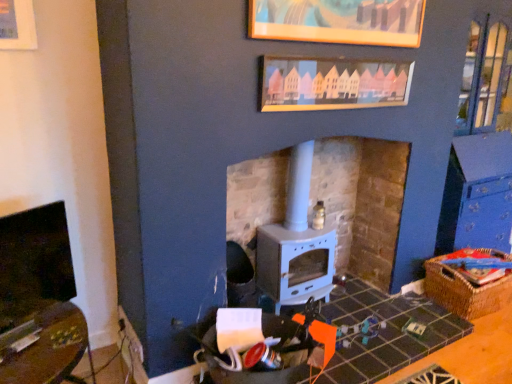
Where is `white matte wood burning stove at center`? white matte wood burning stove at center is located at coordinates (295, 244).

Where is `wooden picture frame at upper center, arranged as the 2th picture frame when viewed from the top`? wooden picture frame at upper center, arranged as the 2th picture frame when viewed from the top is located at coordinates (332, 84).

What is the approximate height of matte black fireplace at left?

matte black fireplace at left is 47.35 centimeters tall.

Where is `woven brown basket at lower right`? The width and height of the screenshot is (512, 384). woven brown basket at lower right is located at coordinates (467, 287).

In terms of size, does wooden picture frame at upper center, the first picture frame positioned from the bottom, appear bigger or smaller than woven brown basket at lower right?

Clearly, wooden picture frame at upper center, the first picture frame positioned from the bottom, is smaller in size than woven brown basket at lower right.

Between point (379, 67) and point (442, 264), which one is positioned behind?

The point (442, 264) is more distant.

What's the angular difference between wooden picture frame at upper center, arranged as the 2th picture frame when viewed from the top, and woven brown basket at lower right's facing directions?

There is a 0.9-degree angle between the facing directions of wooden picture frame at upper center, arranged as the 2th picture frame when viewed from the top, and woven brown basket at lower right.

Does wooden picture frame at upper center, arranged as the 2th picture frame when viewed from the top, appear on the left side of woven brown basket at lower right?

Indeed, wooden picture frame at upper center, arranged as the 2th picture frame when viewed from the top, is positioned on the left side of woven brown basket at lower right.

Who is smaller, white matte wood burning stove at center or matte black fireplace at left?

Smaller between the two is matte black fireplace at left.

Locate an element on the screen. The height and width of the screenshot is (384, 512). wood burning stove located above the matte black fireplace at left (from the image's perspective) is located at coordinates (295, 244).

Considering the points (288, 203) and (17, 251), which point is in front, point (288, 203) or point (17, 251)?

The point (17, 251) is closer.

Can you confirm if white matte wood burning stove at center is thinner than matte black fireplace at left?

In fact, white matte wood burning stove at center might be wider than matte black fireplace at left.

Is woven brown basket at lower right taller than wooden picture frame at upper center, arranged as the 2th picture frame when viewed from the top?

Indeed, woven brown basket at lower right has a greater height compared to wooden picture frame at upper center, arranged as the 2th picture frame when viewed from the top.

Does point (474, 299) lie in front of point (285, 96)?

No, (474, 299) is behind (285, 96).

Considering the sizes of objects woven brown basket at lower right and wooden picture frame at upper center, the first picture frame positioned from the bottom, in the image provided, who is thinner, woven brown basket at lower right or wooden picture frame at upper center, the first picture frame positioned from the bottom,?

With smaller width is wooden picture frame at upper center, the first picture frame positioned from the bottom.

Which object is further away from the camera, woven brown basket at lower right or wooden picture frame at upper center, the first picture frame positioned from the bottom?

woven brown basket at lower right is more distant.

Is woven brown basket at lower right surrounding wooden picture frame at upper center, which is the 1th picture frame in top-to-bottom order?

That's incorrect, wooden picture frame at upper center, which is the 1th picture frame in top-to-bottom order, is not inside woven brown basket at lower right.

From the image's perspective, is woven brown basket at lower right below wooden picture frame at upper center, the 2th picture frame from the bottom?

Yes, from the image's perspective, woven brown basket at lower right is beneath wooden picture frame at upper center, the 2th picture frame from the bottom.

In the image, is woven brown basket at lower right positioned in front of or behind wooden picture frame at upper center, the 2th picture frame from the bottom?

Clearly, woven brown basket at lower right is behind wooden picture frame at upper center, the 2th picture frame from the bottom.

In the scene shown: Is the surface of woven brown basket at lower right in direct contact with wooden picture frame at upper center, which is the 1th picture frame in top-to-bottom order?

No, woven brown basket at lower right is not touching wooden picture frame at upper center, which is the 1th picture frame in top-to-bottom order.

From a real-world perspective, who is located higher, wooden picture frame at upper center, arranged as the 2th picture frame when viewed from the top, or matte black fireplace at left?

wooden picture frame at upper center, arranged as the 2th picture frame when viewed from the top, from a real-world perspective.

Is wooden picture frame at upper center, the first picture frame positioned from the bottom, situated inside matte black fireplace at left or outside?

wooden picture frame at upper center, the first picture frame positioned from the bottom, exists outside the volume of matte black fireplace at left.

Considering the points (353, 96) and (3, 304), which point is in front, point (353, 96) or point (3, 304)?

Point (3, 304)

Is wooden picture frame at upper center, the first picture frame positioned from the bottom, turned away from matte black fireplace at left?

That's not correct — wooden picture frame at upper center, the first picture frame positioned from the bottom, is not looking away from matte black fireplace at left.

From a real-world perspective, is wooden picture frame at upper center, the first picture frame positioned from the bottom, below wooden picture frame at upper center, which is the 1th picture frame in top-to-bottom order?

Yes, from a real-world perspective, wooden picture frame at upper center, the first picture frame positioned from the bottom, is beneath wooden picture frame at upper center, which is the 1th picture frame in top-to-bottom order.

Is wooden picture frame at upper center, the first picture frame positioned from the bottom, next to wooden picture frame at upper center, which is the 1th picture frame in top-to-bottom order, and touching it?

They are not placed beside each other.

Is wooden picture frame at upper center, the first picture frame positioned from the bottom, turned away from wooden picture frame at upper center, which is the 1th picture frame in top-to-bottom order?

wooden picture frame at upper center, the first picture frame positioned from the bottom, is not turned away from wooden picture frame at upper center, which is the 1th picture frame in top-to-bottom order.

How much distance is there between wooden picture frame at upper center, arranged as the 2th picture frame when viewed from the top, and wooden picture frame at upper center, which is the 1th picture frame in top-to-bottom order?

wooden picture frame at upper center, arranged as the 2th picture frame when viewed from the top, is 7.37 inches from wooden picture frame at upper center, which is the 1th picture frame in top-to-bottom order.

Could you measure the distance between matte black fireplace at left and wooden picture frame at upper center, arranged as the 2th picture frame when viewed from the top?

A distance of 1.21 meters exists between matte black fireplace at left and wooden picture frame at upper center, arranged as the 2th picture frame when viewed from the top.

From a real-world perspective, which is physically above, matte black fireplace at left or wooden picture frame at upper center, the first picture frame positioned from the bottom?

Answer: In real-world perspective, wooden picture frame at upper center, the first picture frame positioned from the bottom, is above.

Which point is more distant from viewer, (x=53, y=266) or (x=331, y=84)?

The point (x=331, y=84) is farther.

Is matte black fireplace at left far away from wooden picture frame at upper center, arranged as the 2th picture frame when viewed from the top?

Yes.

At what (x,y) coordinates should I click in order to perform the action: click on crate below the wooden picture frame at upper center, the first picture frame positioned from the bottom (from the image's perspective). Please return your answer as a coordinate pair (x, y). Looking at the image, I should click on (467, 287).

The height and width of the screenshot is (384, 512). I want to click on wood burning stove below the matte black fireplace at left (from a real-world perspective), so click(x=295, y=244).

Considering their positions, is white matte wood burning stove at center positioned further to wooden picture frame at upper center, arranged as the 2th picture frame when viewed from the top, than wooden picture frame at upper center, which is the 1th picture frame in top-to-bottom order?

The object further to wooden picture frame at upper center, arranged as the 2th picture frame when viewed from the top, is white matte wood burning stove at center.

Which object lies further to the anchor point white matte wood burning stove at center, woven brown basket at lower right or matte black fireplace at left?

matte black fireplace at left is further to white matte wood burning stove at center.

Estimate the real-world distances between objects in this image. Which object is further from wooden picture frame at upper center, which is the 1th picture frame in top-to-bottom order, matte black fireplace at left or woven brown basket at lower right?

woven brown basket at lower right.

Which object lies nearer to the anchor point matte black fireplace at left, woven brown basket at lower right or wooden picture frame at upper center, the first picture frame positioned from the bottom?

wooden picture frame at upper center, the first picture frame positioned from the bottom, is closer to matte black fireplace at left.

From the image, which object appears to be nearer to wooden picture frame at upper center, which is the 1th picture frame in top-to-bottom order, white matte wood burning stove at center or wooden picture frame at upper center, arranged as the 2th picture frame when viewed from the top?

wooden picture frame at upper center, arranged as the 2th picture frame when viewed from the top, is positioned closer to the anchor wooden picture frame at upper center, which is the 1th picture frame in top-to-bottom order.

In the scene shown: When comparing their distances from wooden picture frame at upper center, the first picture frame positioned from the bottom, does wooden picture frame at upper center, which is the 1th picture frame in top-to-bottom order, or white matte wood burning stove at center seem closer?

wooden picture frame at upper center, which is the 1th picture frame in top-to-bottom order, lies closer to wooden picture frame at upper center, the first picture frame positioned from the bottom, than the other object.

Based on their spatial positions, is wooden picture frame at upper center, the first picture frame positioned from the bottom, or white matte wood burning stove at center closer to woven brown basket at lower right?

The object closer to woven brown basket at lower right is white matte wood burning stove at center.

In the scene shown: From the image, which object appears to be farther from woven brown basket at lower right, wooden picture frame at upper center, which is the 1th picture frame in top-to-bottom order, or wooden picture frame at upper center, the first picture frame positioned from the bottom?

The object further to woven brown basket at lower right is wooden picture frame at upper center, which is the 1th picture frame in top-to-bottom order.

At what (x,y) coordinates should I click in order to perform the action: click on picture frame between wooden picture frame at upper center, which is the 1th picture frame in top-to-bottom order, and woven brown basket at lower right in the up-down direction. Please return your answer as a coordinate pair (x, y). Looking at the image, I should click on point(332,84).

The height and width of the screenshot is (384, 512). Find the location of `wood burning stove between matte black fireplace at left and wooden picture frame at upper center, the first picture frame positioned from the bottom, in the horizontal direction`. wood burning stove between matte black fireplace at left and wooden picture frame at upper center, the first picture frame positioned from the bottom, in the horizontal direction is located at coordinates (295, 244).

Image resolution: width=512 pixels, height=384 pixels. In order to click on picture frame between matte black fireplace at left and wooden picture frame at upper center, the first picture frame positioned from the bottom, in the horizontal direction in this screenshot , I will do `click(338, 21)`.

In order to click on wood burning stove between matte black fireplace at left and wooden picture frame at upper center, the 2th picture frame from the bottom, from left to right in this screenshot , I will do `click(295, 244)`.